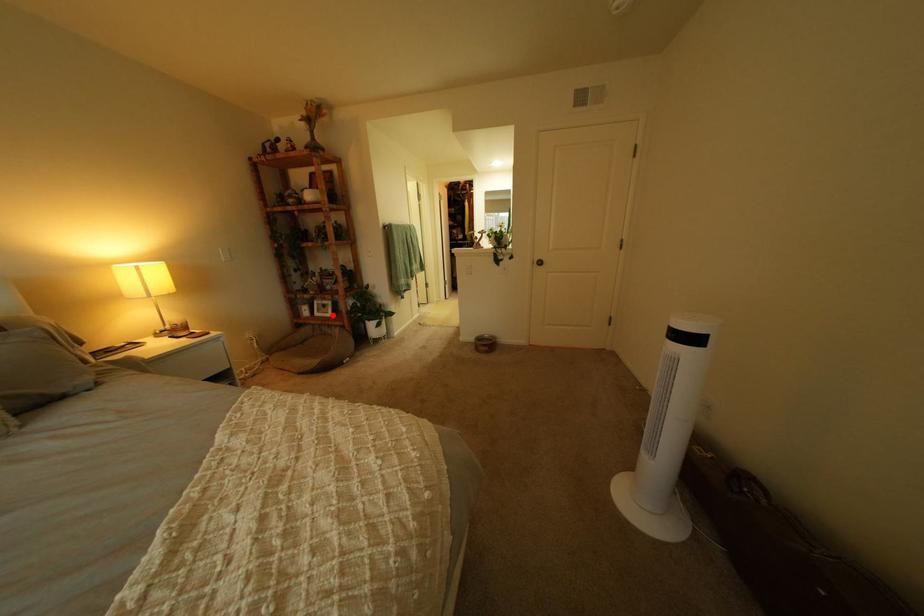
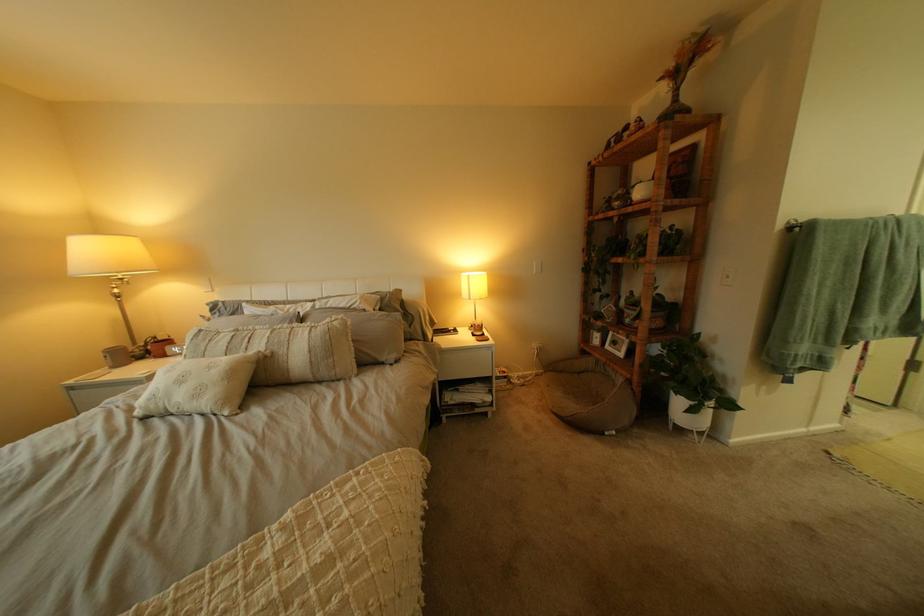
Find the pixel in the second image that matches the highlighted location in the first image.

(623, 347)